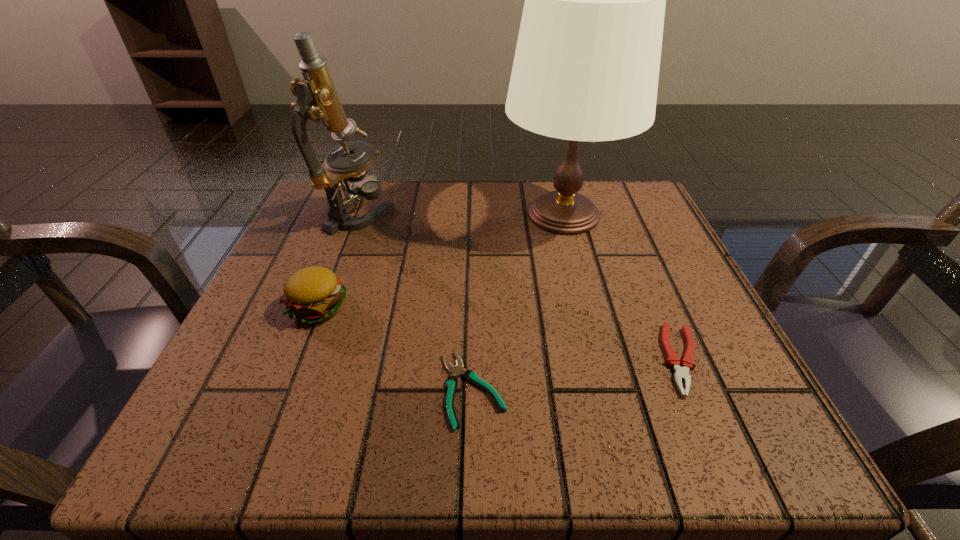
Where is `blank space located on the back of the taller pliers`? The width and height of the screenshot is (960, 540). blank space located on the back of the taller pliers is located at coordinates (631, 239).

You are a GUI agent. You are given a task and a screenshot of the screen. Output one action in this format:
    pyautogui.click(x=<x>, y=<y>)
    Task: Click on the vacant space situated 0.260m on the left of the shorter pliers
    The height and width of the screenshot is (540, 960).
    Given the screenshot: What is the action you would take?
    pyautogui.click(x=252, y=389)

I want to click on lamp that is positioned at the far edge, so click(x=586, y=67).

This screenshot has width=960, height=540. I want to click on microscope present at the far edge, so click(317, 99).

You are a GUI agent. You are given a task and a screenshot of the screen. Output one action in this format:
    pyautogui.click(x=<x>, y=<y>)
    Task: Click on the microscope present at the left edge
    This screenshot has height=540, width=960.
    Given the screenshot: What is the action you would take?
    pyautogui.click(x=317, y=99)

This screenshot has height=540, width=960. Find the location of `hamburger positioned at the left edge`. hamburger positioned at the left edge is located at coordinates 314,294.

Identify the location of lamp that is at the right edge. (586, 67).

Find the location of `pliers positioned at the right edge`. pliers positioned at the right edge is located at coordinates (681, 373).

What are the coordinates of `object at the far left corner` in the screenshot? It's located at (317, 99).

You are a GUI agent. You are given a task and a screenshot of the screen. Output one action in this format:
    pyautogui.click(x=<x>, y=<y>)
    Task: Click on the object at the far right corner
    
    Given the screenshot: What is the action you would take?
    pyautogui.click(x=586, y=67)